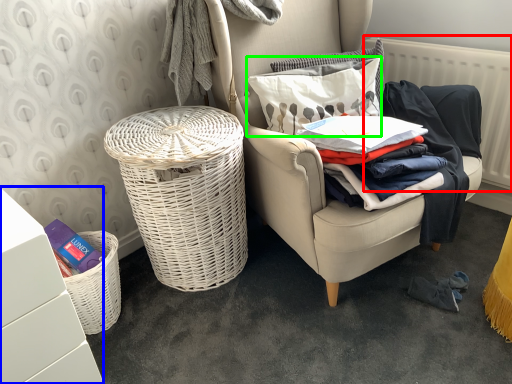
Question: Estimate the real-world distances between objects in this image. Which object is farther from radiator (highlighted by a red box), vanity (highlighted by a blue box) or pillow (highlighted by a green box)?

Choices:
 (A) vanity
 (B) pillow

Answer: (A)